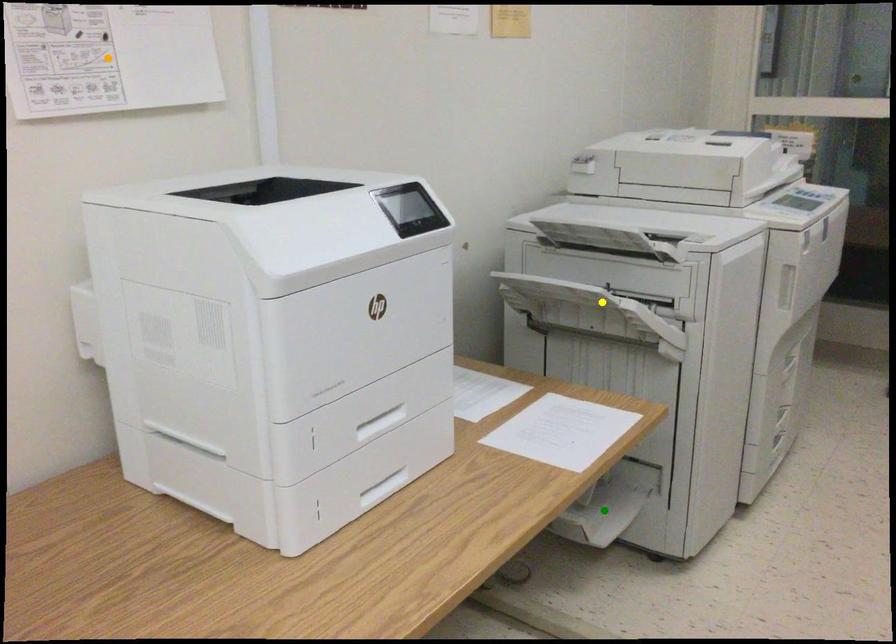
Order these from nearest to farthest:
1. orange point
2. yellow point
3. green point

orange point → yellow point → green point